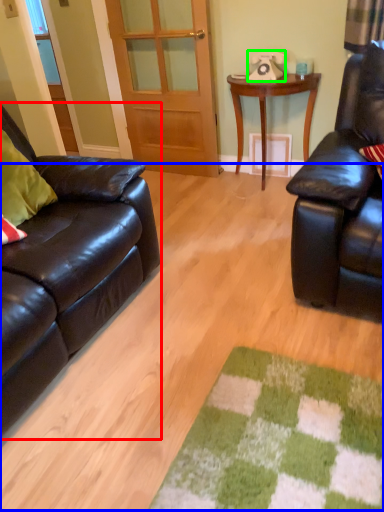
Question: Considering the real-world distances, which object is closest to studio couch (highlighted by a red box)? plain (highlighted by a blue box) or corded phone (highlighted by a green box).

Choices:
 (A) plain
 (B) corded phone

Answer: (A)